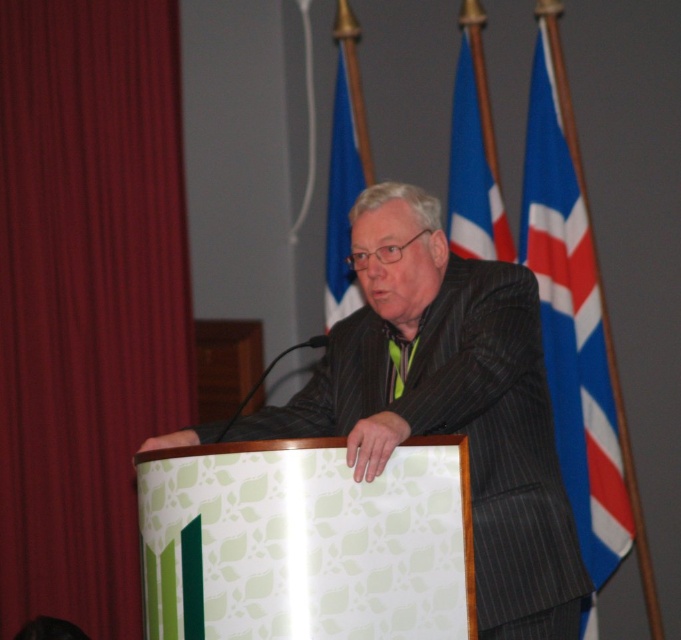
Question: Does dark gray pinstripe suit at center appear over blue fabric flag at upper center?

Choices:
 (A) no
 (B) yes

Answer: (A)

Question: Is blue fabric flag at upper center to the left of blue fabric flag at center from the viewer's perspective?

Choices:
 (A) yes
 (B) no

Answer: (B)

Question: Which of the following is the farthest from the observer?

Choices:
 (A) (340, 241)
 (B) (481, 369)
 (C) (577, 486)
 (D) (394, 381)

Answer: (A)

Question: Which point is farther to the camera?

Choices:
 (A) (475, 28)
 (B) (550, 362)

Answer: (A)

Question: Which point is farther from the camera taking this photo?

Choices:
 (A) (541, 48)
 (B) (159, 195)
 (C) (411, 253)
 (D) (454, 93)

Answer: (B)

Question: Can you confirm if blue fabric flag at right is bigger than green satin tie at center?

Choices:
 (A) no
 (B) yes

Answer: (B)